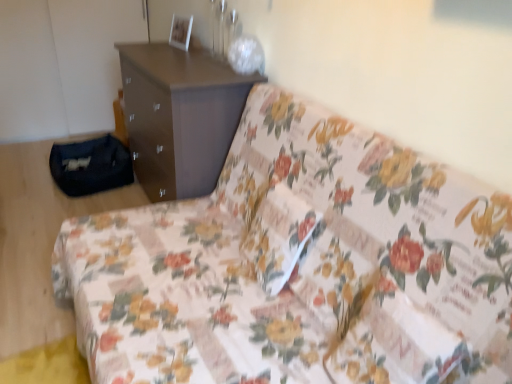
Question: Can you confirm if brown matte chest of drawers at upper center is positioned to the left of floral fabric couch at center?

Choices:
 (A) yes
 (B) no

Answer: (A)

Question: Is brown matte chest of drawers at upper center positioned with its back to floral fabric couch at center?

Choices:
 (A) yes
 (B) no

Answer: (B)

Question: Is brown matte chest of drawers at upper center not inside floral fabric couch at center?

Choices:
 (A) no
 (B) yes

Answer: (B)

Question: From a real-world perspective, does brown matte chest of drawers at upper center sit lower than floral fabric couch at center?

Choices:
 (A) yes
 (B) no

Answer: (A)

Question: From the image's perspective, is brown matte chest of drawers at upper center above floral fabric couch at center?

Choices:
 (A) yes
 (B) no

Answer: (A)

Question: Is point (204, 134) closer or farther from the camera than point (313, 223)?

Choices:
 (A) closer
 (B) farther

Answer: (B)

Question: In terms of height, does brown matte chest of drawers at upper center look taller or shorter compared to floral fabric pillow at center?

Choices:
 (A) short
 (B) tall

Answer: (B)

Question: Would you say brown matte chest of drawers at upper center is inside or outside floral fabric pillow at center?

Choices:
 (A) inside
 (B) outside

Answer: (B)

Question: Relative to floral fabric pillow at center, is brown matte chest of drawers at upper center in front or behind?

Choices:
 (A) front
 (B) behind

Answer: (B)

Question: From the image's perspective, is floral fabric couch at center above or below brown matte chest of drawers at upper center?

Choices:
 (A) below
 (B) above

Answer: (A)

Question: Is floral fabric couch at center wider or thinner than brown matte chest of drawers at upper center?

Choices:
 (A) wide
 (B) thin

Answer: (A)

Question: Based on their sizes in the image, would you say floral fabric couch at center is bigger or smaller than brown matte chest of drawers at upper center?

Choices:
 (A) small
 (B) big

Answer: (B)

Question: Is floral fabric couch at center to the left or to the right of brown matte chest of drawers at upper center in the image?

Choices:
 (A) left
 (B) right

Answer: (B)

Question: From their relative heights in the image, would you say floral fabric pillow at center is taller or shorter than brown matte chest of drawers at upper center?

Choices:
 (A) tall
 (B) short

Answer: (B)

Question: Choose the correct answer: Is floral fabric pillow at center inside brown matte chest of drawers at upper center or outside it?

Choices:
 (A) inside
 (B) outside

Answer: (B)